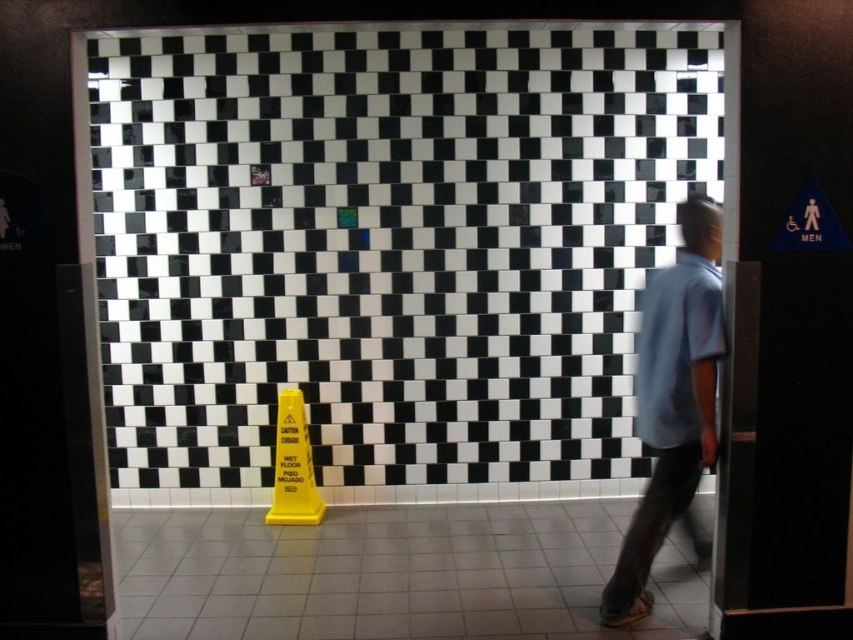
Question: Can you confirm if white tile at lower center is thinner than light blue t-shirt at right?

Choices:
 (A) no
 (B) yes

Answer: (A)

Question: Does black glossy tile at center appear on the right side of white tile at lower center?

Choices:
 (A) no
 (B) yes

Answer: (B)

Question: Which point is farther to the camera?

Choices:
 (A) light blue t-shirt at right
 (B) black glossy tile at center
 (C) white tile at lower center

Answer: (B)

Question: Does black glossy tile at center come behind white tile at lower center?

Choices:
 (A) yes
 (B) no

Answer: (A)

Question: Which object is positioned farthest from the white tile at lower center?

Choices:
 (A) light blue t-shirt at right
 (B) black glossy tile at center

Answer: (B)

Question: Which object is positioned closest to the white tile at lower center?

Choices:
 (A) light blue t-shirt at right
 (B) black glossy tile at center

Answer: (A)